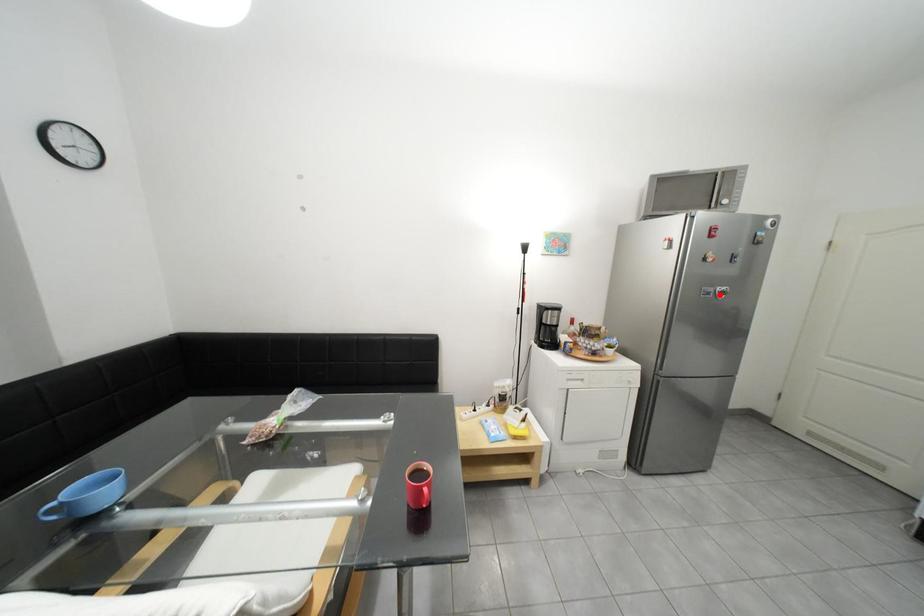
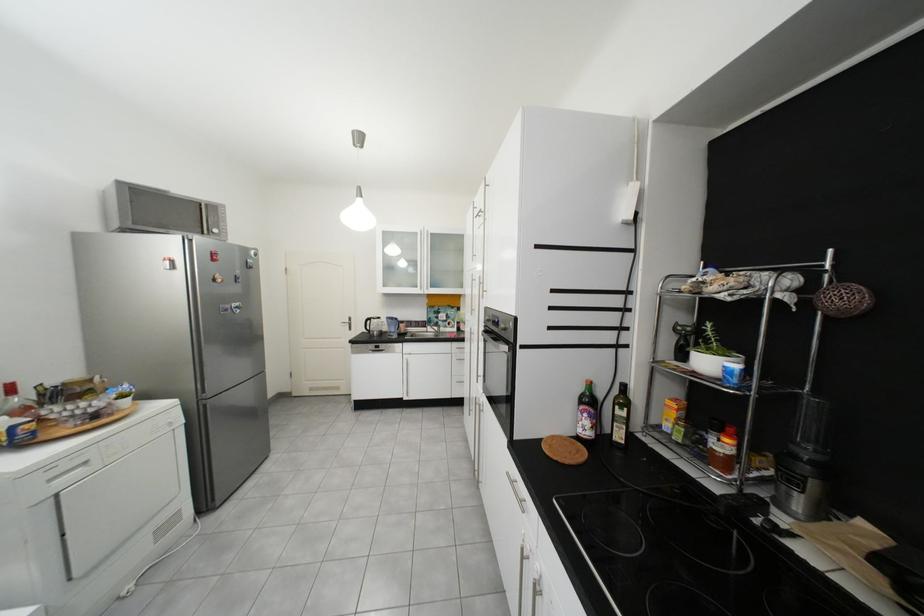
Find the pixel in the second image that matches the highlighted location in the first image.

(237, 310)